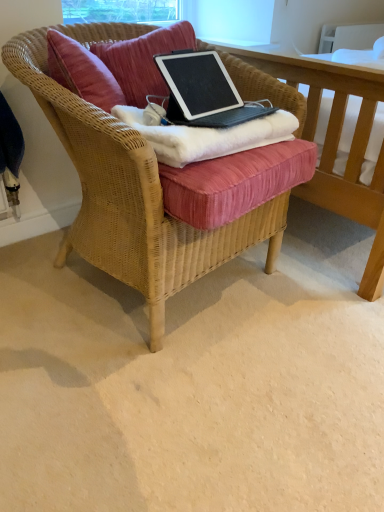
Where is `free spot above white fluffy blanket at center (from a real-world perspective)`? free spot above white fluffy blanket at center (from a real-world perspective) is located at coordinates tap(212, 106).